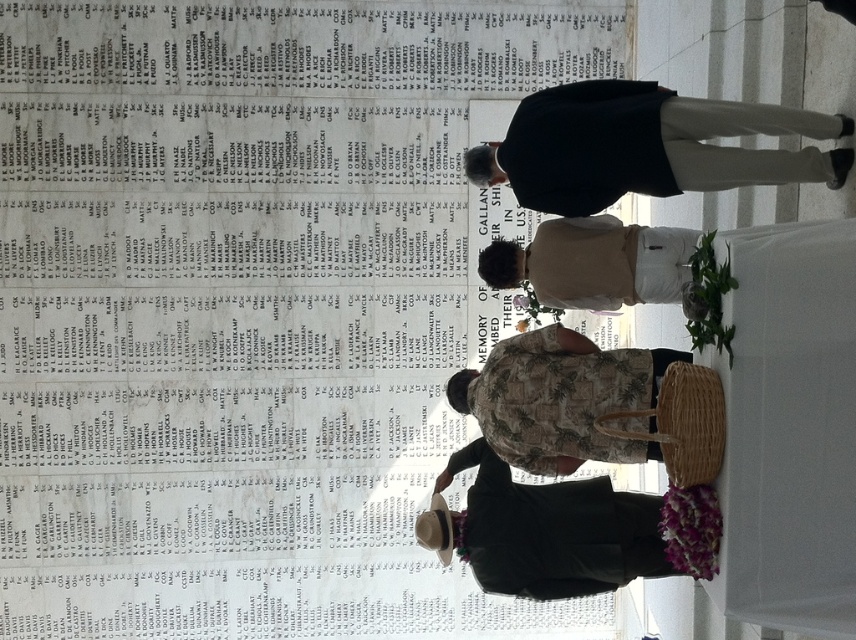
The width and height of the screenshot is (856, 640). Describe the element at coordinates (248, 308) in the screenshot. I see `white marble wall at upper left` at that location.

What are the coordinates of `white marble wall at upper left` in the screenshot? It's located at (248, 308).

I want to click on white marble wall at upper left, so click(x=248, y=308).

Measure the distance from dark blue jacket at center to brown woven basket at lower center.

They are 4.12 meters apart.

Is point (519, 122) behind point (705, 522)?

Yes, point (519, 122) is behind point (705, 522).

The width and height of the screenshot is (856, 640). In order to click on dark blue jacket at center in this screenshot , I will do [x=645, y=147].

Is brown woven basket at lower center thinner than camouflage fabric shirt at center?

No.

Is point (484, 534) closer to camera compared to point (533, 394)?

No.

Is point (619, 500) more distant than point (580, 435)?

That is True.

Locate an element on the screen. This screenshot has width=856, height=640. brown woven basket at lower center is located at coordinates (545, 531).